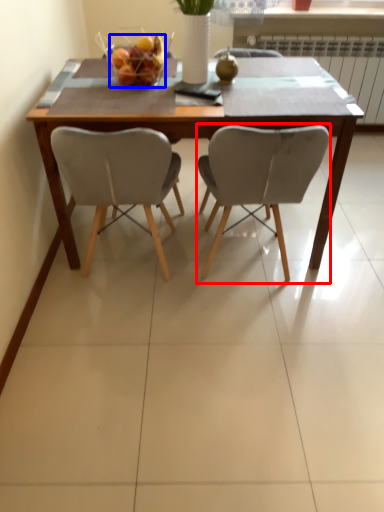
Question: Which point is closer to the camera, chair (highlighted by a red box) or fruit dish (highlighted by a blue box)?

Choices:
 (A) chair
 (B) fruit dish

Answer: (A)